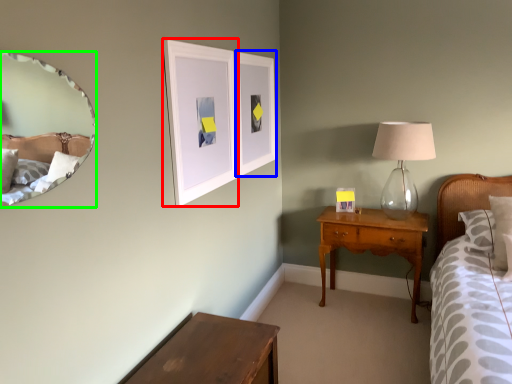
Question: Based on their relative distances, which object is nearer to picture frame (highlighted by a red box)? Choose from picture frame (highlighted by a blue box) and mirror (highlighted by a green box).

Choices:
 (A) picture frame
 (B) mirror

Answer: (A)